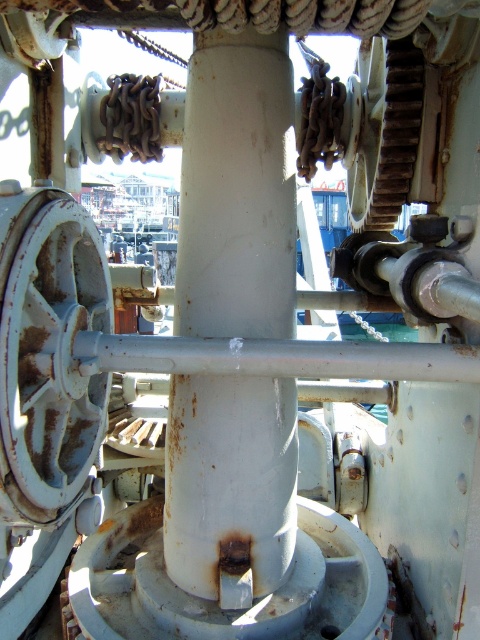
You are an engineer inspecting the mechanical assembly. You need to locate the rusty metal gear at lower left. According to the coordinates provided, where exactly is it positioned?

The rusty metal gear at lower left is located at point 0.547 on the x axis and 0.102 on the y axis.

You are an engineer inspecting the mechanical assembly shown. You notice two points labeled as point 1 and point 2. Point 1 is at coordinate point (84, 280) and point 2 is at coordinate point (358, 225). From your vantage point, which point is closer to you?

Point (84, 280) is closer to you because it is in front of point (358, 225).